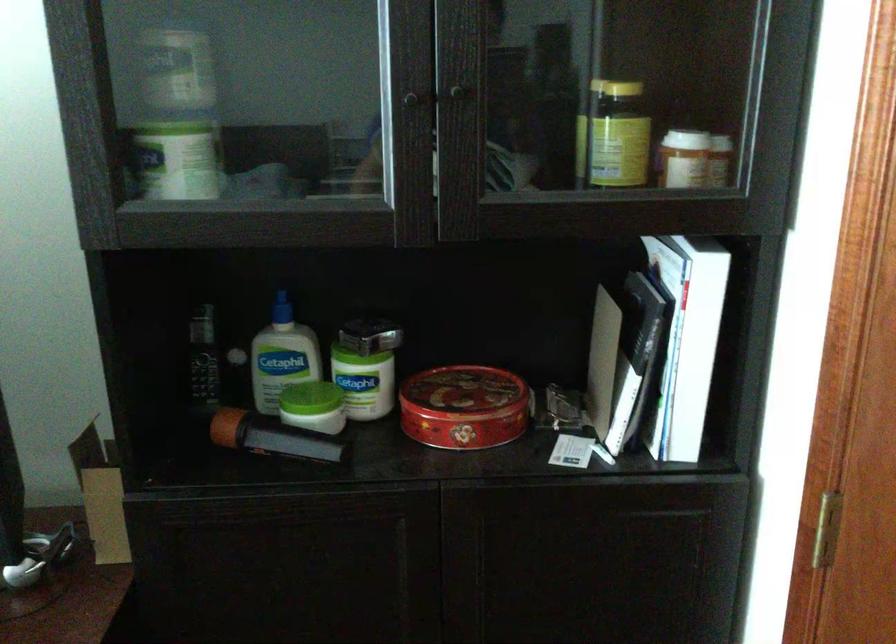
Describe the element at coordinates (615, 89) in the screenshot. This screenshot has width=896, height=644. I see `the yellow bottle cap` at that location.